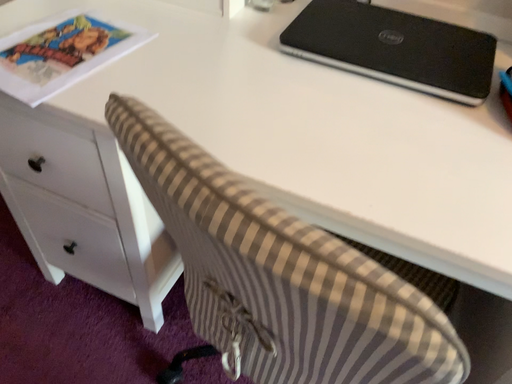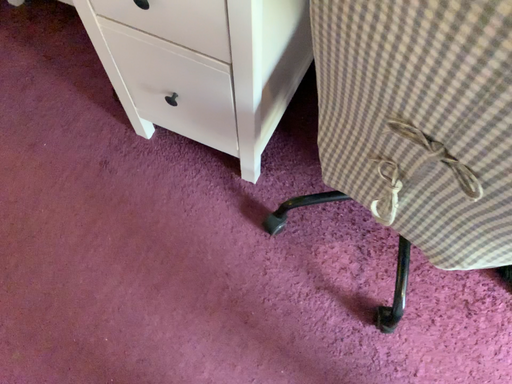
Question: How did the camera likely rotate when shooting the video?

Choices:
 (A) rotated downward
 (B) rotated upward

Answer: (A)